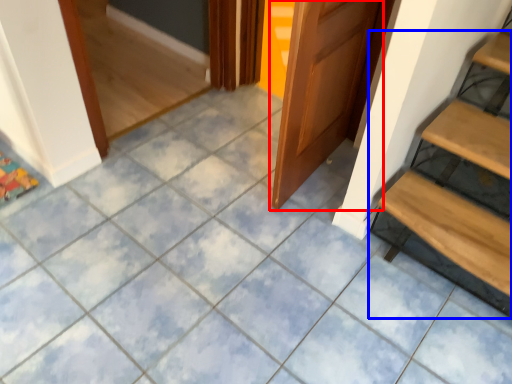
Question: Which object is further to the camera taking this photo, door (highlighted by a red box) or stairs (highlighted by a blue box)?

Choices:
 (A) door
 (B) stairs

Answer: (B)